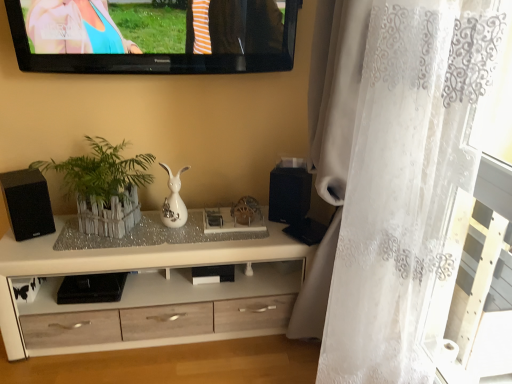
What is the approximate width of black glossy television at upper center?

black glossy television at upper center is 4.87 inches in width.

This screenshot has height=384, width=512. What do you see at coordinates (27, 203) in the screenshot?
I see `black matte speaker at left, arranged as the 2th speaker when viewed from the right` at bounding box center [27, 203].

The image size is (512, 384). I want to click on black matte speaker at center, which is the 1th speaker from right to left, so click(x=289, y=194).

At what (x,y) coordinates should I click in order to perform the action: click on black glossy television at upper center. Please return your answer as a coordinate pair (x, y). Looking at the image, I should click on (154, 36).

From the image's perspective, which object appears higher, black glossy television at upper center or white glossy vase at center?

black glossy television at upper center.

From the picture: Considering the relative positions of black glossy television at upper center and white glossy vase at center in the image provided, is black glossy television at upper center behind white glossy vase at center?

No, black glossy television at upper center is closer to the camera.

Between point (255, 45) and point (175, 192), which one is positioned in front?

Positioned in front is point (255, 45).

You are a GUI agent. You are given a task and a screenshot of the screen. Output one action in this format:
    pyautogui.click(x=<x>, y=<y>)
    Task: Click on the vase located behind the black glossy television at upper center
    The height and width of the screenshot is (384, 512).
    Given the screenshot: What is the action you would take?
    pyautogui.click(x=174, y=201)

Which point is more distant from viewer, (289,170) or (163,215)?

The point (163,215) is farther from the camera.

Is black matte speaker at center, which is the 1th speaker from right to left, inside or outside of white glossy vase at center?

black matte speaker at center, which is the 1th speaker from right to left, is spatially situated outside white glossy vase at center.

How many degrees apart are the facing directions of black matte speaker at center, which is counted as the second speaker, starting from the left, and white glossy vase at center?

They differ by 28.7 degrees in their facing directions.

Considering the sizes of black matte speaker at center, which is the 1th speaker from right to left, and white glossy vase at center in the image, is black matte speaker at center, which is the 1th speaker from right to left, bigger or smaller than white glossy vase at center?

black matte speaker at center, which is the 1th speaker from right to left, is bigger than white glossy vase at center.

From a real-world perspective, which object stands above the other?

In real-world perspective, white lace curtain at right is above.

Based on the photo, is white lace curtain at right wider than white wood cabinet at center?

Yes.

Is white lace curtain at right positioned with its back to white wood cabinet at center?

No, white lace curtain at right is not facing the opposite direction of white wood cabinet at center.

How much distance is there between black matte speaker at left, arranged as the 2th speaker when viewed from the right, and white lace curtain at right?

They are 1.35 meters apart.

Does black matte speaker at left, arranged as the 2th speaker when viewed from the right, turn towards white lace curtain at right?

No, black matte speaker at left, arranged as the 2th speaker when viewed from the right, does not turn towards white lace curtain at right.

Is the depth of black matte speaker at left, arranged as the 2th speaker when viewed from the right, greater than that of white lace curtain at right?

Yes, it is behind white lace curtain at right.

From a real-world perspective, who is located lower, black matte speaker at left, arranged as the 2th speaker when viewed from the right, or white lace curtain at right?

black matte speaker at left, arranged as the 2th speaker when viewed from the right, is physically lower.

Is point (6, 205) closer or farther from the camera than point (119, 65)?

Clearly, point (6, 205) is more distant from the camera than point (119, 65).

Can you confirm if black matte speaker at left, marked as the 1th speaker in a left-to-right arrangement, is positioned to the right of black glossy television at upper center?

No.

Where is `television that is in front of the black matte speaker at left, arranged as the 2th speaker when viewed from the right`? television that is in front of the black matte speaker at left, arranged as the 2th speaker when viewed from the right is located at coordinates (154, 36).

Choose the correct answer: Is black matte speaker at left, arranged as the 2th speaker when viewed from the right, inside black glossy television at upper center or outside it?

black matte speaker at left, arranged as the 2th speaker when viewed from the right, is spatially situated outside black glossy television at upper center.

From a real-world perspective, is white lace curtain at right over clear glass tray at center?

Yes, from a real-world perspective, white lace curtain at right is over clear glass tray at center

In the scene shown: Is white lace curtain at right positioned far away from clear glass tray at center?

No, white lace curtain at right is not far from clear glass tray at center.

Consider the image. Considering the positions of objects white lace curtain at right and clear glass tray at center in the image provided, who is behind, white lace curtain at right or clear glass tray at center?

clear glass tray at center.

From the image's perspective, between white lace curtain at right and clear glass tray at center, who is located below?

From the image's view, clear glass tray at center is below.

From a real-world perspective, which is physically above, black matte speaker at left, arranged as the 2th speaker when viewed from the right, or clear glass tray at center?

black matte speaker at left, arranged as the 2th speaker when viewed from the right, is physically above.

How distant is black matte speaker at left, marked as the 1th speaker in a left-to-right arrangement, from clear glass tray at center?

black matte speaker at left, marked as the 1th speaker in a left-to-right arrangement, is 11.42 inches from clear glass tray at center.

Is black matte speaker at left, arranged as the 2th speaker when viewed from the right, bigger than clear glass tray at center?

Correct, black matte speaker at left, arranged as the 2th speaker when viewed from the right, is larger in size than clear glass tray at center.

Is black matte speaker at left, marked as the 1th speaker in a left-to-right arrangement, aimed at clear glass tray at center?

No, black matte speaker at left, marked as the 1th speaker in a left-to-right arrangement, is not turned towards clear glass tray at center.

The height and width of the screenshot is (384, 512). I want to click on vase that appears below the black glossy television at upper center (from a real-world perspective), so click(174, 201).

There is a black matte speaker at center, which is the 1th speaker from right to left. Where is `vase above it (from a real-world perspective)`? Image resolution: width=512 pixels, height=384 pixels. vase above it (from a real-world perspective) is located at coordinates (174, 201).

Based on their spatial positions, is white wood cabinet at center or clear glass tray at center further from white glossy vase at center?

Among the two, white wood cabinet at center is located further to white glossy vase at center.

Looking at the image, which one is located further to clear glass tray at center, black matte speaker at center, which is counted as the second speaker, starting from the left, or white wooden fence at center?

Based on the image, black matte speaker at center, which is counted as the second speaker, starting from the left, appears to be further to clear glass tray at center.

Estimate the real-world distances between objects in this image. Which object is closer to white glossy vase at center, white wood cabinet at center or white wooden fence at center?

The object closer to white glossy vase at center is white wooden fence at center.

Which object lies further to the anchor point clear glass tray at center, black glossy television at upper center or black matte speaker at left, arranged as the 2th speaker when viewed from the right?

Among the two, black glossy television at upper center is located further to clear glass tray at center.

Looking at the image, which one is located closer to white glossy vase at center, black matte speaker at left, marked as the 1th speaker in a left-to-right arrangement, or white lace curtain at right?

black matte speaker at left, marked as the 1th speaker in a left-to-right arrangement, lies closer to white glossy vase at center than the other object.

Looking at the image, which one is located closer to black glossy television at upper center, clear glass tray at center or white lace curtain at right?

The object closer to black glossy television at upper center is clear glass tray at center.

Based on their spatial positions, is clear glass tray at center or black glossy television at upper center further from white wood cabinet at center?

Based on the image, black glossy television at upper center appears to be further to white wood cabinet at center.

Which object lies further to the anchor point black matte speaker at left, arranged as the 2th speaker when viewed from the right, black matte speaker at center, which is the 1th speaker from right to left, or white wooden fence at center?

black matte speaker at center, which is the 1th speaker from right to left.

I want to click on vase located between white lace curtain at right and black matte speaker at center, which is the 1th speaker from right to left, in the depth direction, so click(174, 201).

The height and width of the screenshot is (384, 512). I want to click on glass table between black matte speaker at left, marked as the 1th speaker in a left-to-right arrangement, and black matte speaker at center, which is the 1th speaker from right to left, so click(149, 234).

The image size is (512, 384). Identify the location of glass table positioned between white lace curtain at right and black matte speaker at center, which is counted as the second speaker, starting from the left, from near to far. (149, 234).

The width and height of the screenshot is (512, 384). Identify the location of houseplant between black glossy television at upper center and white wood cabinet at center in the vertical direction. (104, 186).